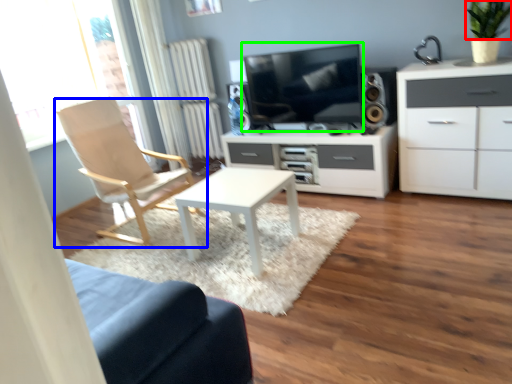
Question: Estimate the real-world distances between objects in this image. Which object is farther from plant (highlighted by a red box), chair (highlighted by a blue box) or television (highlighted by a green box)?

Choices:
 (A) chair
 (B) television

Answer: (A)